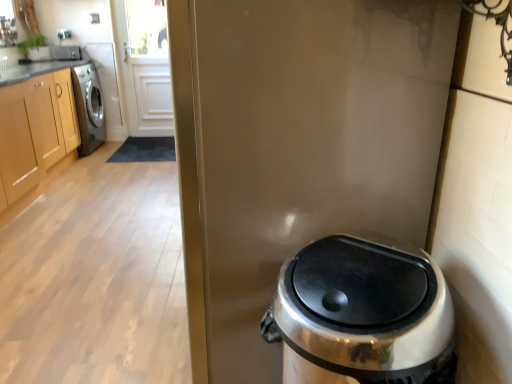
Question: From a real-world perspective, does satin silver trash can at lower right sit lower than glossy metallic screen door at center?

Choices:
 (A) yes
 (B) no

Answer: (A)

Question: Considering the relative sizes of satin silver trash can at lower right and glossy metallic screen door at center in the image provided, is satin silver trash can at lower right smaller than glossy metallic screen door at center?

Choices:
 (A) no
 (B) yes

Answer: (B)

Question: Is satin silver trash can at lower right directly adjacent to glossy metallic screen door at center?

Choices:
 (A) yes
 (B) no

Answer: (B)

Question: Does satin silver trash can at lower right have a greater width compared to glossy metallic screen door at center?

Choices:
 (A) no
 (B) yes

Answer: (A)

Question: Is satin silver trash can at lower right at the left side of glossy metallic screen door at center?

Choices:
 (A) no
 (B) yes

Answer: (A)

Question: From a real-world perspective, is light brown wood cabinets at left physically located above or below satin silver trash can at lower right?

Choices:
 (A) above
 (B) below

Answer: (A)

Question: Is light brown wood cabinets at left wider or thinner than satin silver trash can at lower right?

Choices:
 (A) wide
 (B) thin

Answer: (A)

Question: Considering the relative positions of light brown wood cabinets at left and satin silver trash can at lower right in the image provided, is light brown wood cabinets at left to the left or to the right of satin silver trash can at lower right?

Choices:
 (A) right
 (B) left

Answer: (B)

Question: Is light brown wood cabinets at left inside the boundaries of satin silver trash can at lower right, or outside?

Choices:
 (A) outside
 (B) inside

Answer: (A)

Question: Is satin silver trash can at lower right wider or thinner than light brown wood cabinets at left?

Choices:
 (A) thin
 (B) wide

Answer: (A)

Question: From the image's perspective, relative to light brown wood cabinets at left, is satin silver trash can at lower right above or below?

Choices:
 (A) below
 (B) above

Answer: (A)

Question: Would you say satin silver trash can at lower right is inside or outside light brown wood cabinets at left?

Choices:
 (A) inside
 (B) outside

Answer: (B)

Question: Relative to light brown wood cabinets at left, is satin silver trash can at lower right in front or behind?

Choices:
 (A) front
 (B) behind

Answer: (A)

Question: Would you say glossy metallic screen door at center is to the left or to the right of satin silver trash can at lower right in the picture?

Choices:
 (A) right
 (B) left

Answer: (B)

Question: Considering their positions, is glossy metallic screen door at center located in front of or behind satin silver trash can at lower right?

Choices:
 (A) front
 (B) behind

Answer: (B)